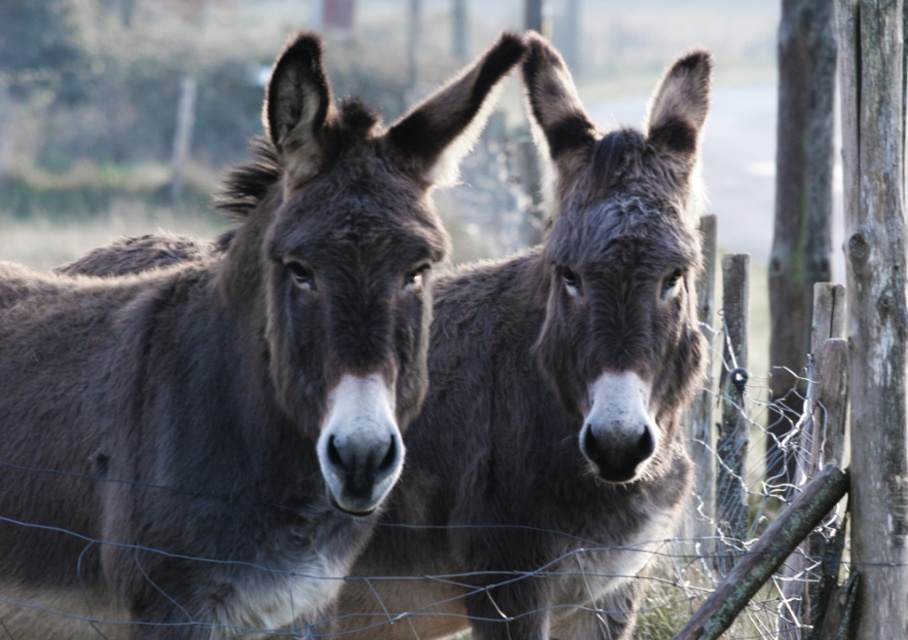
Does point (293, 147) come farther from viewer compared to point (484, 588)?

No.

Is dark brown fur mule at center positioned before dark gray fur at center?

Yes, dark brown fur mule at center is closer to the viewer.

Which is in front, point (329, 216) or point (574, 412)?

Point (329, 216)

The height and width of the screenshot is (640, 908). Identify the location of dark brown fur mule at center. (230, 384).